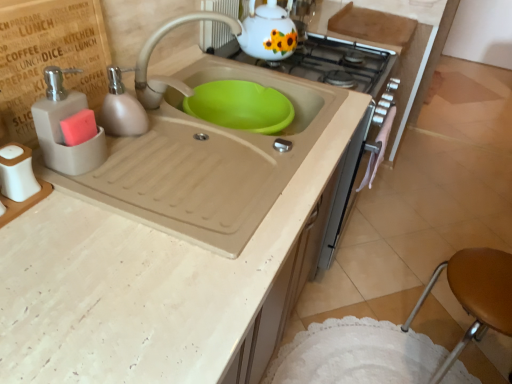
This screenshot has width=512, height=384. I want to click on free space to the left of brown leather stool at lower right, so click(x=353, y=338).